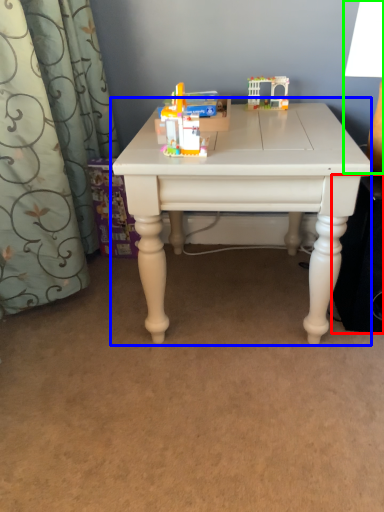
Question: Which object is positioned closest to speaker (highlighted by a red box)? Select from table (highlighted by a blue box) and table lamp (highlighted by a green box).

Choices:
 (A) table
 (B) table lamp

Answer: (A)